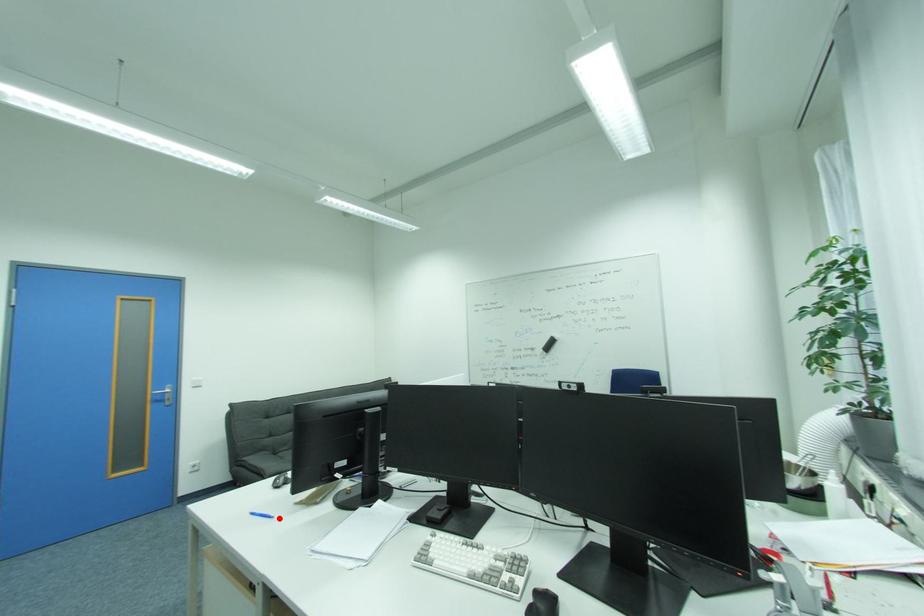
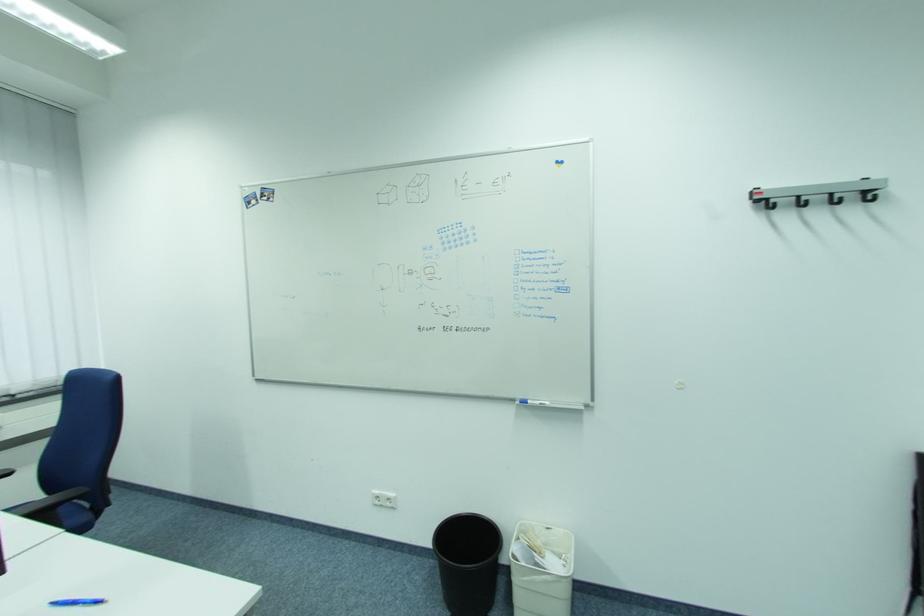
The point at the highlighted location is marked in the first image. Where is the corresponding point in the second image?

(57, 605)